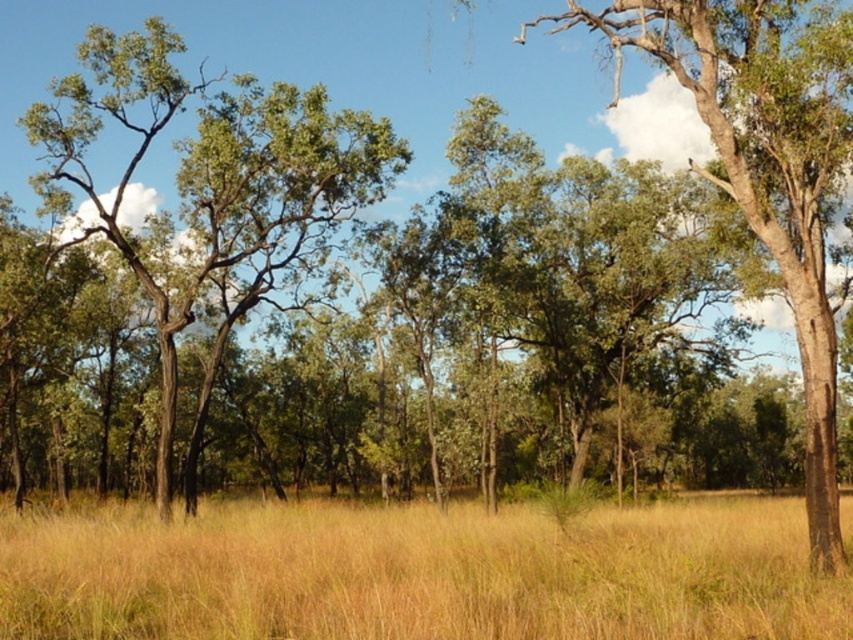
You are standing in the middle of the yellow grass at center and want to walk to the green leafy tree at left. Which direction should you head to reach the tree?

The green leafy tree at left is located to the left side of the yellow grass at center, so you should head towards the left direction to reach it.

You are standing in the center of the field and want to walk towards the yellow grass at center. Which direction should you head?

The yellow grass at center is already at the center of the field, so you are already facing it. There is no need to change direction.